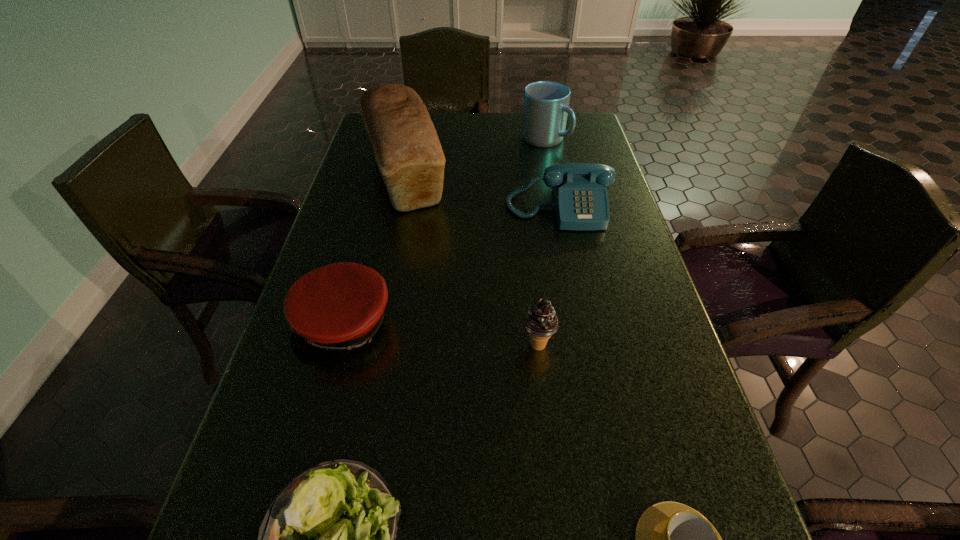
The width and height of the screenshot is (960, 540). In order to click on bread at the far edge in this screenshot , I will do `click(407, 149)`.

Locate an element on the screen. mug situated at the far edge is located at coordinates (546, 103).

The height and width of the screenshot is (540, 960). Identify the location of bread at the left edge. (407, 149).

The height and width of the screenshot is (540, 960). In order to click on cap that is at the left edge in this screenshot , I will do `click(332, 310)`.

Image resolution: width=960 pixels, height=540 pixels. I want to click on mug present at the right edge, so click(546, 103).

At what (x,y) coordinates should I click in order to perform the action: click on telephone situated at the right edge. Please return your answer as a coordinate pair (x, y). Looking at the image, I should click on (580, 195).

Where is `object at the far left corner`? The height and width of the screenshot is (540, 960). object at the far left corner is located at coordinates (407, 149).

Identify the location of object present at the far right corner. (546, 103).

Find the location of a particular element. The image size is (960, 540). vacant space at the far edge is located at coordinates (462, 127).

This screenshot has height=540, width=960. Find the location of `vacant point at the left edge`. vacant point at the left edge is located at coordinates (336, 409).